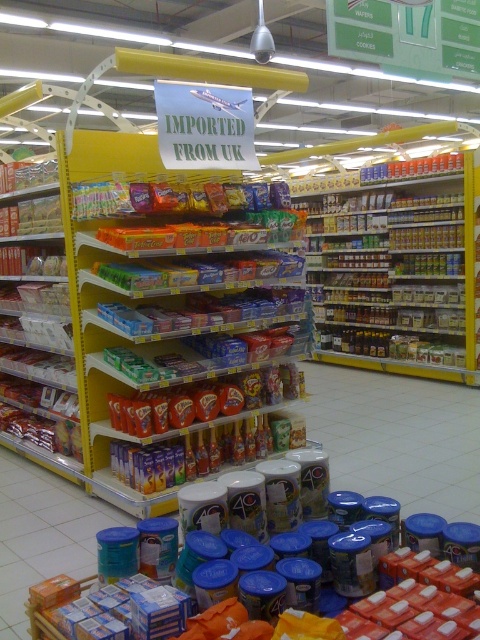
You are a customer in the grocery store and want to reach both the shiny plastic candy at center and the matte plastic snack at left. Which one is placed lower on the shelf?

The shiny plastic candy at center is located below the matte plastic snack at left, so it is placed lower on the shelf.

You are standing in the grocery store aisle looking at the imported UK goods section. There are two points marked on the shelves. Which point is closer to you, point (191,360) or point (70,612)?

Point (70,612) is closer to you because the description states that point (191,360) is further to the camera than point (70,612).